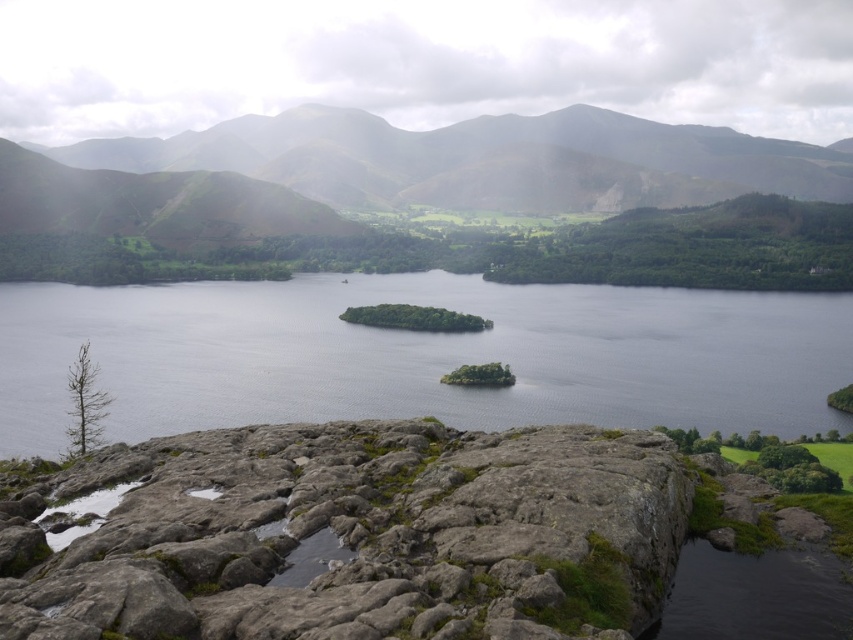
You are planning to build a small garden on the green grassy hill at upper center. Since the clear water at center is nearby, you want to know if the garden area will be larger than the water body. Can you confirm?

The clear water at center is narrower than the green grassy hill at upper center, so the garden area on the green grassy hill at upper center will be larger than the clear water at center.

You are standing at the bottom of the image and want to place a small flag on the gray rock at bottom. What are the coordinates where you should place it?

The gray rock at bottom is located at coordinates point (361, 536), so place the flag there.